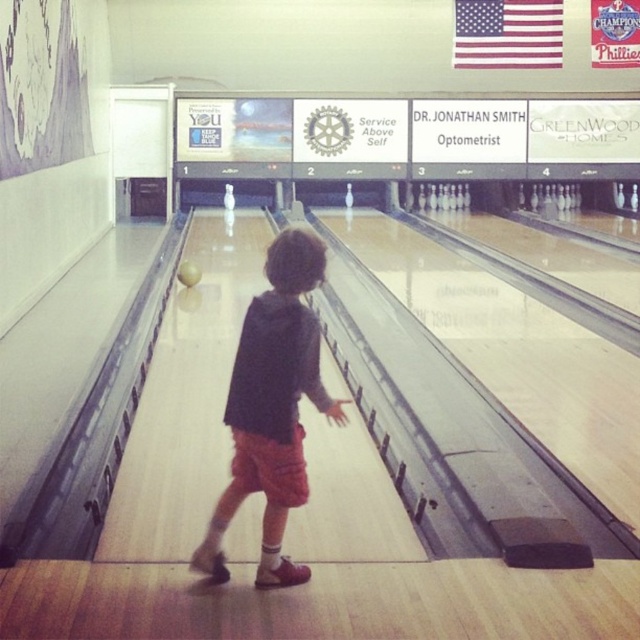
Who is shorter, dark gray hoodie at center or yellow matte bowling ball at center?

yellow matte bowling ball at center is shorter.

Is dark gray hoodie at center further to camera compared to yellow matte bowling ball at center?

No, dark gray hoodie at center is in front of yellow matte bowling ball at center.

The width and height of the screenshot is (640, 640). Find the location of `dark gray hoodie at center`. dark gray hoodie at center is located at coordinates (273, 406).

Where is `dark gray hoodie at center`? dark gray hoodie at center is located at coordinates (273, 406).